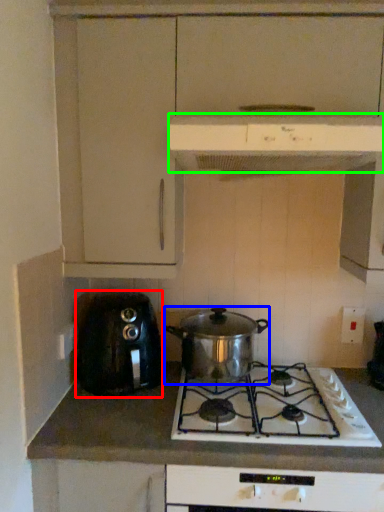
Question: Which object is the closest to the toaster (highlighted by a red box)? Choose among these: kitchen appliance (highlighted by a blue box) or kitchen appliance (highlighted by a green box).

Choices:
 (A) kitchen appliance
 (B) kitchen appliance

Answer: (A)